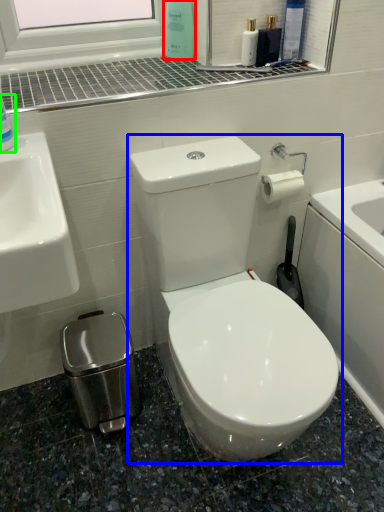
Question: Considering the real-world distances, which object is farthest from cleaning product (highlighted by a red box)? toilet (highlighted by a blue box) or cleaning product (highlighted by a green box)?

Choices:
 (A) toilet
 (B) cleaning product

Answer: (A)